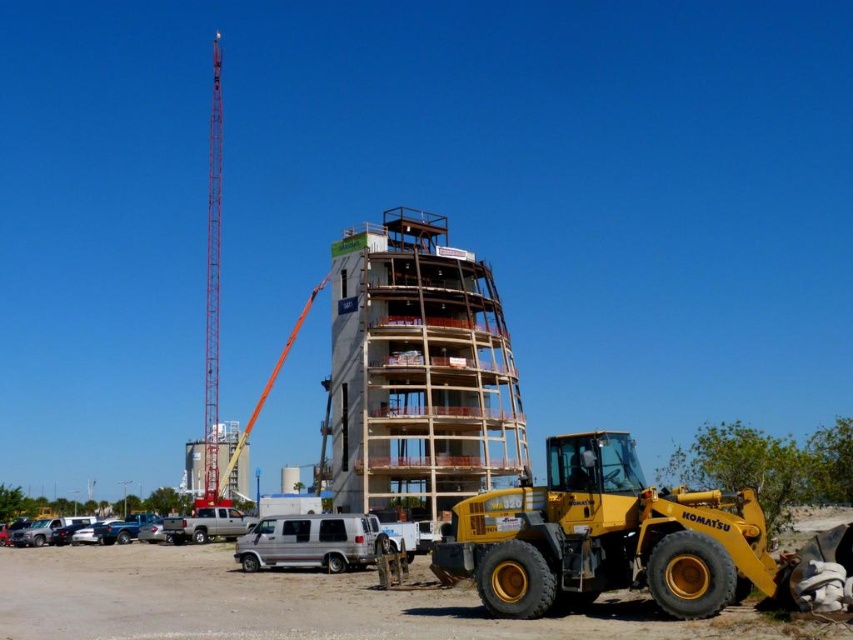
Question: Which of the following is the farthest from the observer?

Choices:
 (A) wooden scaffolding at center
 (B) red metallic tower crane at left

Answer: (B)

Question: Based on their relative distances, which object is nearer to the silver metallic van at center?

Choices:
 (A) wooden scaffolding at center
 (B) red metallic tower crane at left

Answer: (A)

Question: In this image, where is wooden scaffolding at center located relative to silver metallic van at center?

Choices:
 (A) left
 (B) right

Answer: (B)

Question: Which object is closer to the camera taking this photo?

Choices:
 (A) wooden scaffolding at center
 (B) red metallic tower crane at left
 (C) silver metallic van at center

Answer: (C)

Question: Is wooden scaffolding at center thinner than silver metallic van at center?

Choices:
 (A) yes
 (B) no

Answer: (B)

Question: Observing the image, what is the correct spatial positioning of wooden scaffolding at center in reference to red metallic tower crane at left?

Choices:
 (A) right
 (B) left

Answer: (A)